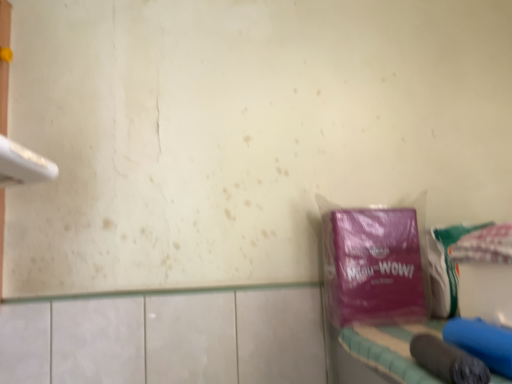
Question: Is purple matte plastic bag at right smaller than blue fabric vanity at lower right?

Choices:
 (A) yes
 (B) no

Answer: (A)

Question: Is purple matte plastic bag at right located outside blue fabric vanity at lower right?

Choices:
 (A) no
 (B) yes

Answer: (B)

Question: Can you confirm if purple matte plastic bag at right is taller than blue fabric vanity at lower right?

Choices:
 (A) no
 (B) yes

Answer: (B)

Question: Is purple matte plastic bag at right shorter than blue fabric vanity at lower right?

Choices:
 (A) no
 (B) yes

Answer: (A)

Question: Can you confirm if purple matte plastic bag at right is positioned to the right of blue fabric vanity at lower right?

Choices:
 (A) no
 (B) yes

Answer: (A)

Question: Is purple matte plastic bag at right facing away from blue fabric vanity at lower right?

Choices:
 (A) no
 (B) yes

Answer: (A)

Question: Could you tell me if blue fabric vanity at lower right is turned towards purple matte plastic bag at right?

Choices:
 (A) no
 (B) yes

Answer: (A)

Question: From a real-world perspective, is blue fabric vanity at lower right beneath purple matte plastic bag at right?

Choices:
 (A) yes
 (B) no

Answer: (A)

Question: Does blue fabric vanity at lower right touch purple matte plastic bag at right?

Choices:
 (A) yes
 (B) no

Answer: (B)

Question: Is purple matte plastic bag at right located within blue fabric vanity at lower right?

Choices:
 (A) no
 (B) yes

Answer: (A)

Question: From a real-world perspective, is blue fabric vanity at lower right physically above purple matte plastic bag at right?

Choices:
 (A) yes
 (B) no

Answer: (B)

Question: Is blue fabric vanity at lower right positioned beyond the bounds of purple matte plastic bag at right?

Choices:
 (A) no
 (B) yes

Answer: (B)

Question: Considering the positions of point (415, 327) and point (351, 283), is point (415, 327) closer or farther from the camera than point (351, 283)?

Choices:
 (A) closer
 (B) farther

Answer: (A)